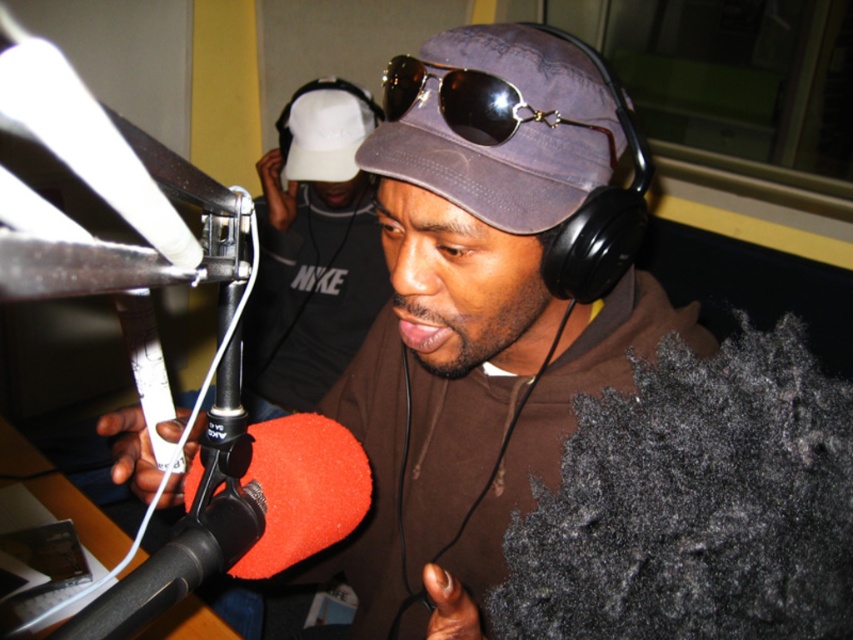
You are setting up a camera in the radio studio to capture the man in the brown hoodie and the purple canvas hat at center. Based on their positions, where should you position the camera to ensure both are in frame?

The purple canvas hat at center is located at point (498, 124), so position the camera centrally to include both the man in the brown hoodie and the purple canvas hat at center within the frame.

Based on the photo, you are a guest in the radio studio and want to greet both the host and the producer. The host is wearing the purple canvas hat at center and the producer is wearing the white matte baseball cap at upper center. Since you can only move forward or backward, which person should you approach first based on their positions?

The purple canvas hat at center is to the right of the white matte baseball cap at upper center, so you should approach the white matte baseball cap at upper center first since it is closer to your current position in the studio.